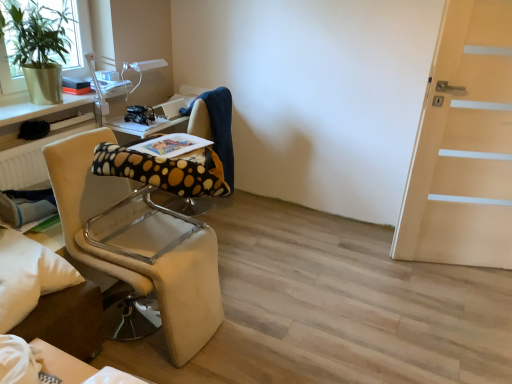
Question: From a real-world perspective, is polka dot fabric computer chair at center on top of metallic silver table at upper left?

Choices:
 (A) yes
 (B) no

Answer: (B)

Question: Is polka dot fabric computer chair at center far from metallic silver table at upper left?

Choices:
 (A) yes
 (B) no

Answer: (B)

Question: Is polka dot fabric computer chair at center turned away from metallic silver table at upper left?

Choices:
 (A) yes
 (B) no

Answer: (B)

Question: Does polka dot fabric computer chair at center have a greater width compared to metallic silver table at upper left?

Choices:
 (A) yes
 (B) no

Answer: (A)

Question: Is polka dot fabric computer chair at center in contact with metallic silver table at upper left?

Choices:
 (A) no
 (B) yes

Answer: (A)

Question: From a real-world perspective, is polka dot fabric computer chair at center under metallic silver table at upper left?

Choices:
 (A) yes
 (B) no

Answer: (A)

Question: Can you confirm if black plastic headphones at center is taller than beige fabric chair at left?

Choices:
 (A) yes
 (B) no

Answer: (B)

Question: Is black plastic headphones at center positioned with its back to beige fabric chair at left?

Choices:
 (A) no
 (B) yes

Answer: (A)

Question: Can you confirm if black plastic headphones at center is thinner than beige fabric chair at left?

Choices:
 (A) no
 (B) yes

Answer: (B)

Question: Is black plastic headphones at center not within beige fabric chair at left?

Choices:
 (A) yes
 (B) no

Answer: (A)

Question: Can you confirm if black plastic headphones at center is smaller than beige fabric chair at left?

Choices:
 (A) no
 (B) yes

Answer: (B)

Question: Would you consider black plastic headphones at center to be distant from beige fabric chair at left?

Choices:
 (A) no
 (B) yes

Answer: (A)

Question: Considering the relative sizes of metallic silver table at upper left and beige fabric chair at left in the image provided, is metallic silver table at upper left smaller than beige fabric chair at left?

Choices:
 (A) yes
 (B) no

Answer: (A)